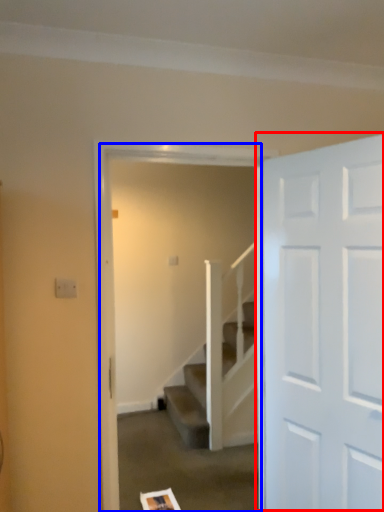
Question: Which object appears closest to the camera in this image, door (highlighted by a red box) or screen door (highlighted by a blue box)?

Choices:
 (A) door
 (B) screen door

Answer: (A)